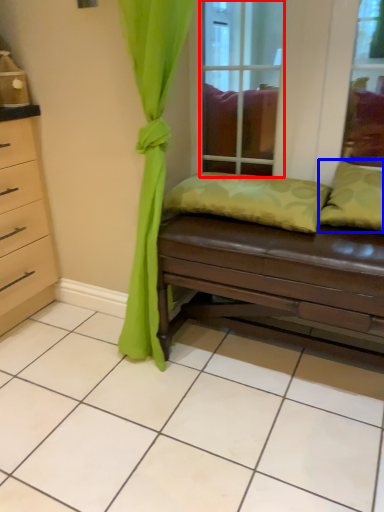
Question: Which point is further to the camera, glass door (highlighted by a red box) or pillow (highlighted by a blue box)?

Choices:
 (A) glass door
 (B) pillow

Answer: (A)